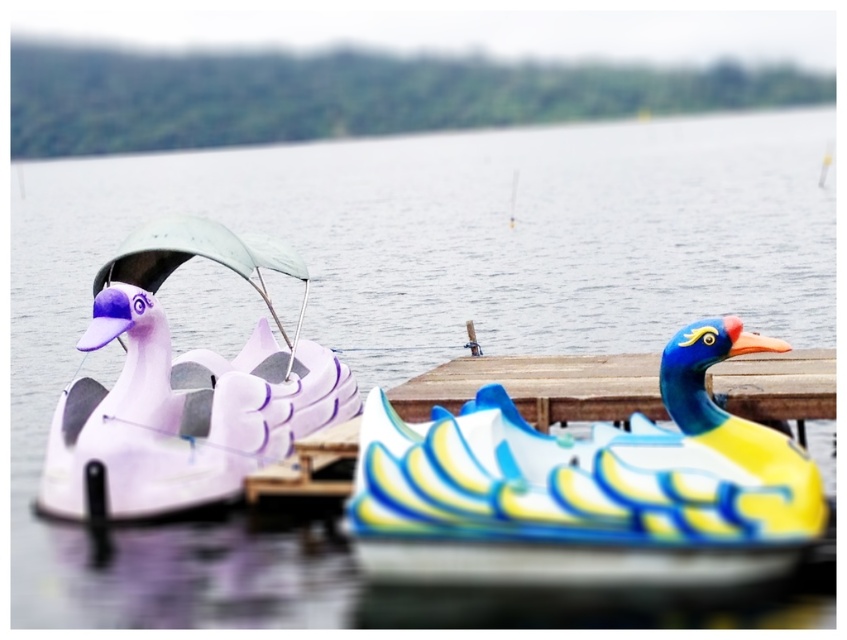
Question: Which point is farther from the camera taking this photo?

Choices:
 (A) (113, 480)
 (B) (590, 400)

Answer: (A)

Question: Observing the image, what is the correct spatial positioning of matte purple duck at left in reference to wooden dock at center?

Choices:
 (A) below
 (B) above

Answer: (A)

Question: Among these objects, which one is farthest from the camera?

Choices:
 (A) matte purple duck at left
 (B) wooden dock at center

Answer: (A)

Question: Is the position of matte purple duck at left less distant than that of wooden dock at center?

Choices:
 (A) no
 (B) yes

Answer: (A)

Question: Can you confirm if matte purple duck at left is positioned to the left of wooden dock at center?

Choices:
 (A) yes
 (B) no

Answer: (A)

Question: Which object appears closest to the camera in this image?

Choices:
 (A) wooden dock at center
 (B) matte purple duck at left

Answer: (A)